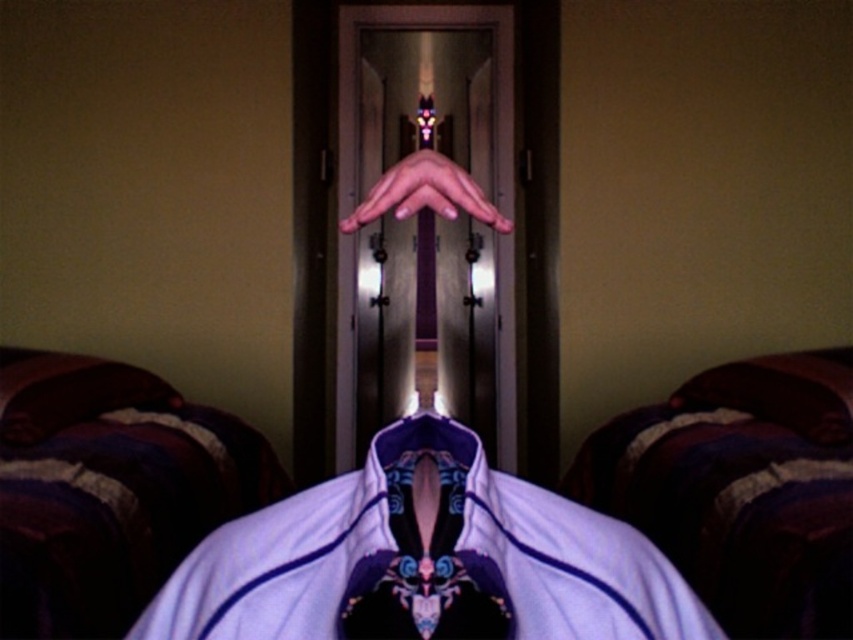
Does white satin dress shirt at center have a lesser width compared to matte purple hand at center?

Incorrect, white satin dress shirt at center's width is not less than matte purple hand at center's.

Is point (509, 634) farther from viewer compared to point (462, 184)?

No, it is in front of (462, 184).

Where is `white satin dress shirt at center`? The height and width of the screenshot is (640, 853). white satin dress shirt at center is located at coordinates (425, 560).

Which is above, purple satin robe at center or matte purple hand at center?

matte purple hand at center is above.

Can you confirm if purple satin robe at center is positioned to the right of matte purple hand at center?

Incorrect, purple satin robe at center is not on the right side of matte purple hand at center.

Is point (502, 557) closer to viewer compared to point (415, 156)?

Yes, point (502, 557) is in front of point (415, 156).

Identify the location of purple satin robe at center. (425, 560).

Does purple satin robe at center have a greater width compared to white satin dress shirt at center?

No, purple satin robe at center is not wider than white satin dress shirt at center.

Who is taller, purple satin robe at center or white satin dress shirt at center?

purple satin robe at center is taller.

Does point (376, 568) lie in front of point (216, 572)?

Yes, point (376, 568) is closer to viewer.

Where is `purple satin robe at center`? The width and height of the screenshot is (853, 640). purple satin robe at center is located at coordinates (425, 560).